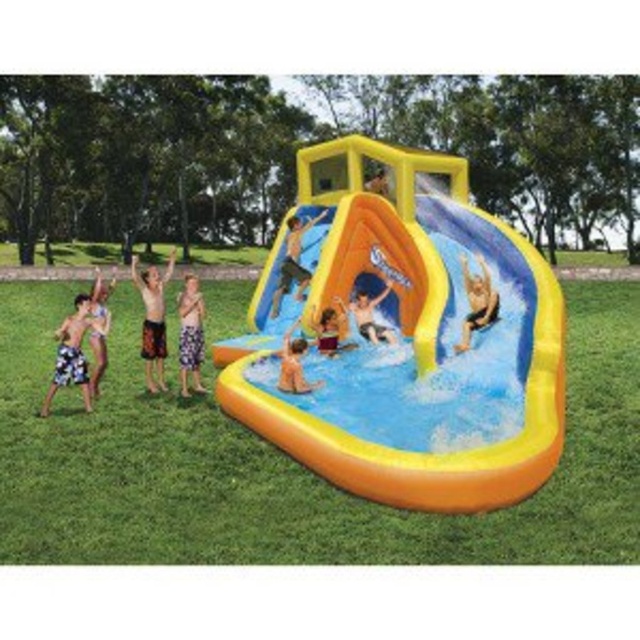
Question: From the image, what is the correct spatial relationship of light blue fabric shorts at left in relation to smooth white surfboard at center?

Choices:
 (A) right
 (B) left

Answer: (B)

Question: Does smooth white surfboard at center have a smaller size compared to smooth yellow slide at center?

Choices:
 (A) no
 (B) yes

Answer: (B)

Question: Estimate the real-world distances between objects in this image. Which object is closer to the inflatable yellow at center?

Choices:
 (A) smooth yellow slide at center
 (B) smooth yellow swim trunks at center
 (C) blue striped shorts at center
 (D) smooth white surfboard at center

Answer: (C)

Question: Is inflatable yellow at center to the right of smooth white surfboard at center from the viewer's perspective?

Choices:
 (A) no
 (B) yes

Answer: (A)

Question: Which of the following is the closest to the observer?

Choices:
 (A) (385, 285)
 (B) (156, 326)
 (C) (308, 388)
 (D) (328, 348)

Answer: (C)

Question: Which object appears closest to the camera in this image?

Choices:
 (A) smooth yellow swim trunks at center
 (B) light blue fabric shorts at left
 (C) inflatable yellow at center

Answer: (C)